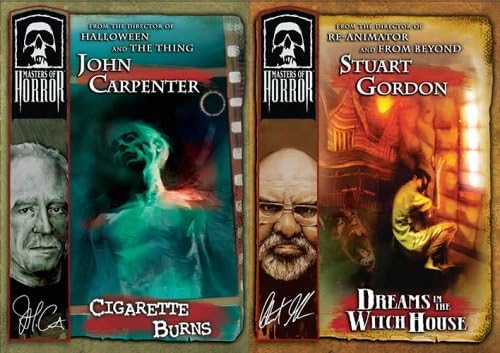
The width and height of the screenshot is (500, 353). Find the location of `left book`. left book is located at coordinates (56, 122).